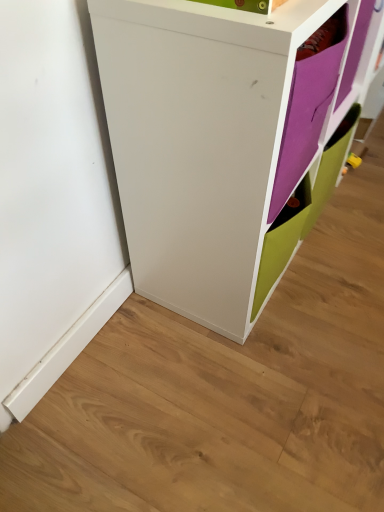
Where is `vacant space in front of white matte cabinet at center`? vacant space in front of white matte cabinet at center is located at coordinates (243, 377).